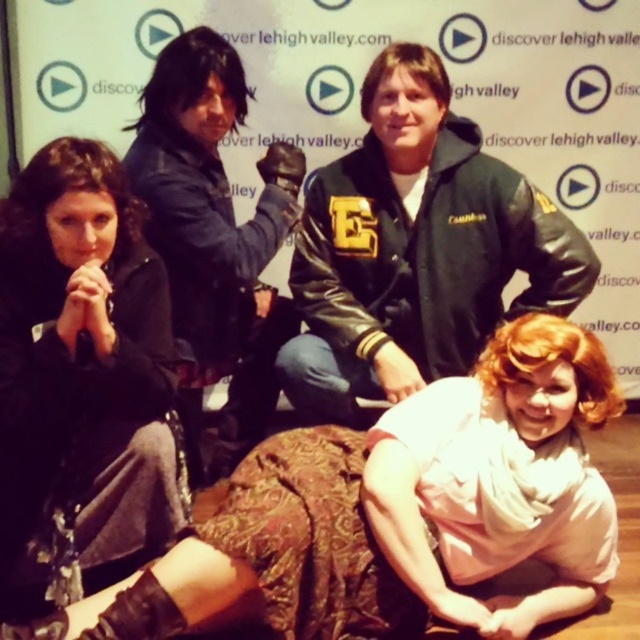
Question: Which object is closer to the camera taking this photo?

Choices:
 (A) light pink fabric at lower right
 (B) black leather jacket at upper center
 (C) black matte jacket at center

Answer: (A)

Question: Which object is the farthest from the black leather jacket at upper center?

Choices:
 (A) light pink fabric at lower right
 (B) black leather jacket at center

Answer: (A)

Question: Can you confirm if black matte jacket at center is thinner than black leather jacket at center?

Choices:
 (A) yes
 (B) no

Answer: (A)

Question: Can you confirm if light pink fabric at lower right is positioned to the left of black leather jacket at center?

Choices:
 (A) yes
 (B) no

Answer: (A)

Question: Can you confirm if black leather jacket at center is positioned below black leather jacket at upper center?

Choices:
 (A) no
 (B) yes

Answer: (B)

Question: Which of the following is the farthest from the observer?

Choices:
 (A) (51, 182)
 (B) (269, 573)
 (C) (148, 124)

Answer: (C)